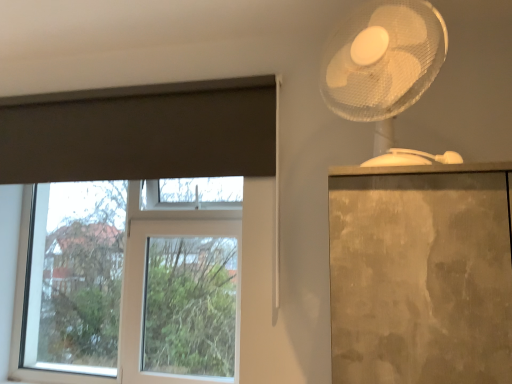
This screenshot has width=512, height=384. What are the coordinates of `clear glass window at left` in the screenshot? It's located at (133, 285).

Locate an element on the screen. The height and width of the screenshot is (384, 512). dark gray matte curtain at upper left is located at coordinates (141, 132).

Does white plastic fan at upper right have a lesser width compared to dark gray matte curtain at upper left?

In fact, white plastic fan at upper right might be wider than dark gray matte curtain at upper left.

Is point (378, 115) more distant than point (14, 100)?

No, it is not.

At what (x,y) coordinates should I click in order to perform the action: click on mechanical fan below the dark gray matte curtain at upper left (from a real-world perspective). Please return your answer as a coordinate pair (x, y). Looking at the image, I should click on tap(385, 71).

From a real-world perspective, is white plastic fan at upper right on top of dark gray matte curtain at upper left?

Actually, white plastic fan at upper right is physically below dark gray matte curtain at upper left in the real world.

From the image's perspective, would you say dark gray matte curtain at upper left is shown under clear glass window at left?

No.

Can we say dark gray matte curtain at upper left lies outside clear glass window at left?

Yes, dark gray matte curtain at upper left is located beyond the bounds of clear glass window at left.

Looking at their sizes, would you say dark gray matte curtain at upper left is wider or thinner than clear glass window at left?

In the image, dark gray matte curtain at upper left appears to be more narrow than clear glass window at left.

Does white plastic fan at upper right have a greater width compared to clear glass window at left?

Yes.

From a real-world perspective, is white plastic fan at upper right beneath clear glass window at left?

No, from a real-world perspective, white plastic fan at upper right is not beneath clear glass window at left.

Who is bigger, white plastic fan at upper right or clear glass window at left?

With larger size is clear glass window at left.

The height and width of the screenshot is (384, 512). Identify the location of mechanical fan on the right of dark gray matte curtain at upper left. (385, 71).

Is dark gray matte curtain at upper left positioned far away from white plastic fan at upper right?

dark gray matte curtain at upper left is near white plastic fan at upper right, not far away.

Considering the relative positions of dark gray matte curtain at upper left and white plastic fan at upper right in the image provided, is dark gray matte curtain at upper left behind white plastic fan at upper right?

Yes, it is.

Is white plastic fan at upper right inside dark gray matte curtain at upper left?

Definitely not — white plastic fan at upper right is not inside dark gray matte curtain at upper left.

Is clear glass window at left smaller than dark gray matte curtain at upper left?

Actually, clear glass window at left might be larger than dark gray matte curtain at upper left.

From the picture: From a real-world perspective, does clear glass window at left stand above dark gray matte curtain at upper left?

No.

Which is more to the right, clear glass window at left or dark gray matte curtain at upper left?

dark gray matte curtain at upper left is more to the right.

Is clear glass window at left thinner than dark gray matte curtain at upper left?

No, clear glass window at left is not thinner than dark gray matte curtain at upper left.

Is clear glass window at left oriented away from white plastic fan at upper right?

No, clear glass window at left is not facing away from white plastic fan at upper right.

Where is `mechanical fan that appears on the right of clear glass window at left`? mechanical fan that appears on the right of clear glass window at left is located at coordinates (385, 71).

Which is closer, (174, 324) or (362, 7)?

The point (362, 7) is closer to the camera.

Where is `mechanical fan above the dark gray matte curtain at upper left (from the image's perspective)`? The image size is (512, 384). mechanical fan above the dark gray matte curtain at upper left (from the image's perspective) is located at coordinates (385, 71).

Locate an element on the screen. This screenshot has width=512, height=384. curtain that is above the clear glass window at left (from a real-world perspective) is located at coordinates (x=141, y=132).

From the image, which object appears to be nearer to clear glass window at left, dark gray matte curtain at upper left or white plastic fan at upper right?

dark gray matte curtain at upper left lies closer to clear glass window at left than the other object.

When comparing their distances from white plastic fan at upper right, does dark gray matte curtain at upper left or clear glass window at left seem closer?

Among the two, dark gray matte curtain at upper left is located nearer to white plastic fan at upper right.

Looking at the image, which one is located closer to clear glass window at left, white plastic fan at upper right or dark gray matte curtain at upper left?

The object closer to clear glass window at left is dark gray matte curtain at upper left.

Based on their spatial positions, is clear glass window at left or white plastic fan at upper right closer to dark gray matte curtain at upper left?

The object closer to dark gray matte curtain at upper left is clear glass window at left.

When comparing their distances from white plastic fan at upper right, does clear glass window at left or dark gray matte curtain at upper left seem closer?

dark gray matte curtain at upper left is closer to white plastic fan at upper right.

Estimate the real-world distances between objects in this image. Which object is further from dark gray matte curtain at upper left, white plastic fan at upper right or clear glass window at left?

Among the two, white plastic fan at upper right is located further to dark gray matte curtain at upper left.

Find the location of a particular element. This screenshot has width=512, height=384. curtain between clear glass window at left and white plastic fan at upper right is located at coordinates (141, 132).